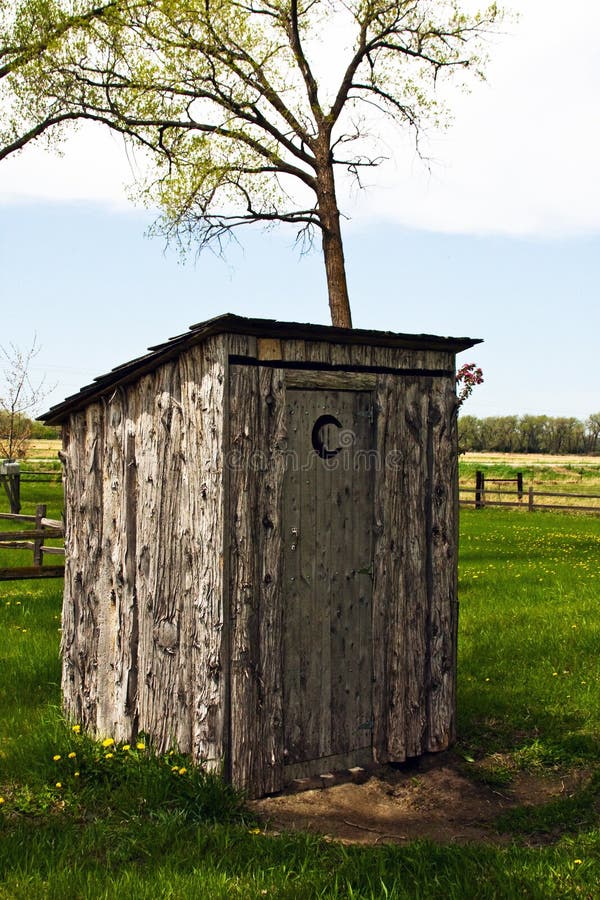
The width and height of the screenshot is (600, 900). Identify the location of door. (328, 588).